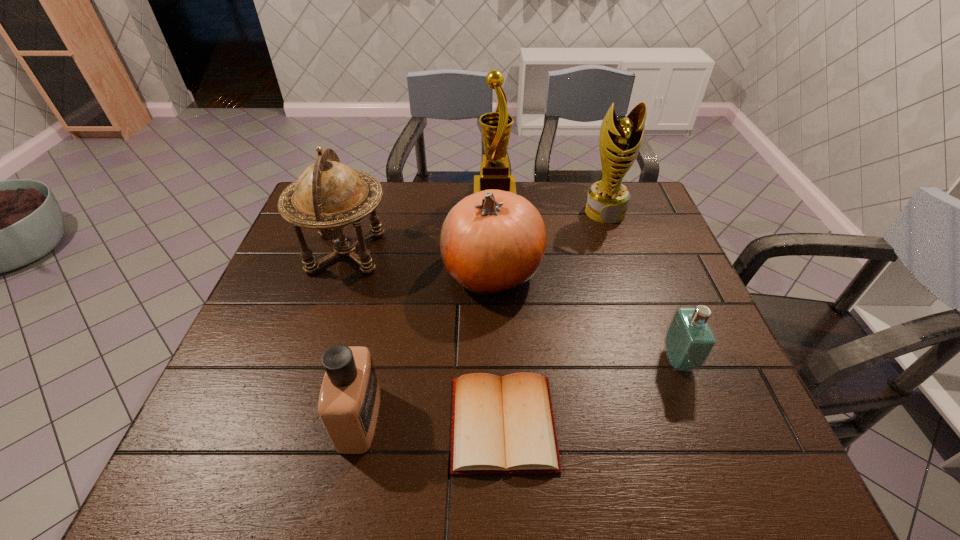
Where is `the left award`? This screenshot has width=960, height=540. the left award is located at coordinates (496, 126).

Where is `the right award`? This screenshot has height=540, width=960. the right award is located at coordinates (607, 200).

This screenshot has width=960, height=540. In order to click on globe in this screenshot , I will do 328,195.

Identify the location of the fourth shortest object. The height and width of the screenshot is (540, 960). (491, 241).

Where is `the third shortest object`? the third shortest object is located at coordinates (349, 399).

Locate an element on the screen. This screenshot has width=960, height=540. the left perfume is located at coordinates (349, 399).

You are a GUI agent. You are given a task and a screenshot of the screen. Output one action in this format:
    pyautogui.click(x=<x>, y=<y>)
    Task: Click on the right perfume
    The image size is (960, 540).
    Given the screenshot: What is the action you would take?
    pyautogui.click(x=689, y=340)

You are a GUI agent. You are given a task and a screenshot of the screen. Output one action in this format:
    pyautogui.click(x=<x>, y=<y>)
    Task: Click on the farther perfume
    This screenshot has width=960, height=540.
    Given the screenshot: What is the action you would take?
    pyautogui.click(x=689, y=340)

Locate an element on the screen. This screenshot has width=960, height=540. Bible is located at coordinates (506, 425).

What are the coordinates of `free location located on the front-facing side of the left award` in the screenshot? It's located at (420, 194).